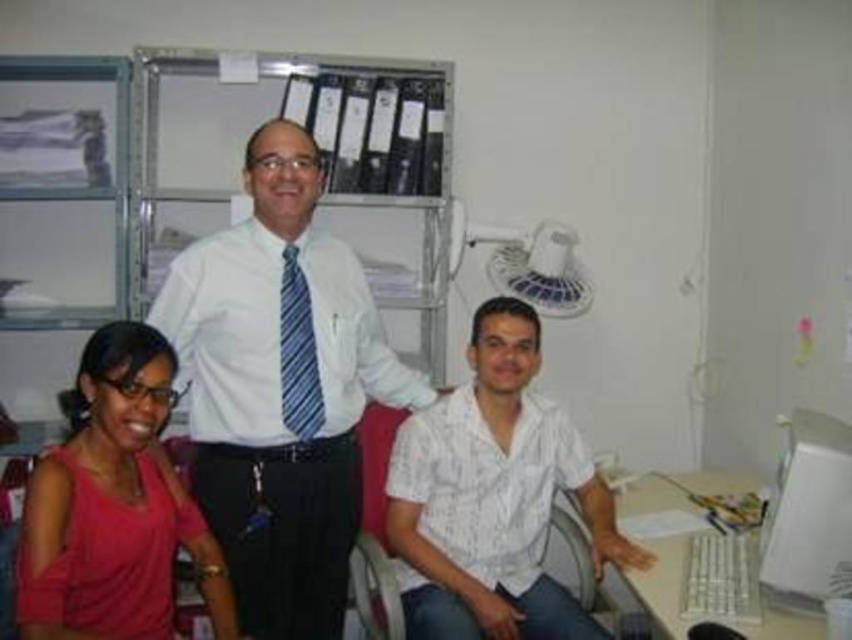
The width and height of the screenshot is (852, 640). Identify the location of white smooth shirt at center. (280, 390).

Locate an element on the screen. white smooth shirt at center is located at coordinates (280, 390).

What are the coordinates of `white smooth shirt at center` in the screenshot? It's located at (280, 390).

Looking at this image, is white plastic computer desk at lower right wider than blue striped tie at center?

Correct, the width of white plastic computer desk at lower right exceeds that of blue striped tie at center.

Which is in front, point (643, 496) or point (295, 266)?

Point (295, 266) is more forward.

In order to click on white plastic computer desk at lower right in this screenshot , I will do `click(678, 490)`.

Can you confirm if white plastic monitor at right is positioned to the right of white plastic computer desk at lower right?

Indeed, white plastic monitor at right is positioned on the right side of white plastic computer desk at lower right.

Is the position of white plastic monitor at right less distant than that of white plastic computer desk at lower right?

That is False.

Who is more distant from viewer, (x=820, y=566) or (x=778, y=612)?

Positioned behind is point (x=778, y=612).

Where is `white plastic monitor at right`? This screenshot has width=852, height=640. white plastic monitor at right is located at coordinates (807, 513).